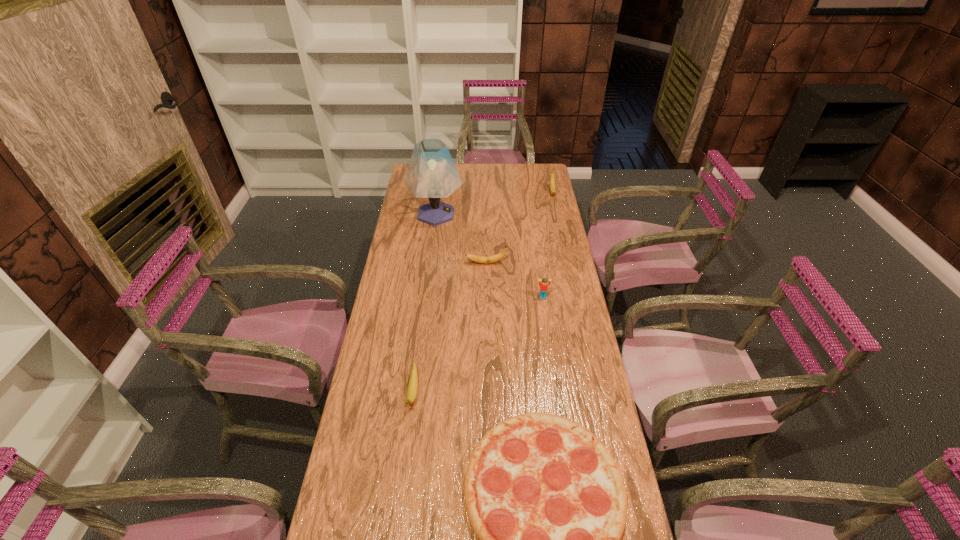
Where is `vacant region located 0.300m at the start of the peel on the farthest banana`? vacant region located 0.300m at the start of the peel on the farthest banana is located at coordinates (563, 236).

The height and width of the screenshot is (540, 960). What are the coordinates of `free spot located 0.060m on the peel of the fourth nearest object from the top` in the screenshot? It's located at (451, 263).

Find the location of a particular element. blank space located on the peel of the fourth nearest object from the top is located at coordinates (393, 263).

Find the location of `vacant space situated on the peel of the fourth nearest object from the top`. vacant space situated on the peel of the fourth nearest object from the top is located at coordinates (390, 263).

Locate an element on the screen. free space located on the face of the Lego is located at coordinates (552, 359).

What are the coordinates of `vacant position located at the stem of the second shortest object` in the screenshot? It's located at (404, 463).

You are a GUI agent. You are given a task and a screenshot of the screen. Output one action in this format:
    pyautogui.click(x=<x>, y=<y>)
    Task: Click on the object at the far edge
    This screenshot has height=540, width=960.
    Given the screenshot: What is the action you would take?
    pyautogui.click(x=552, y=177)

I want to click on lampshade situated at the left edge, so click(432, 174).

Where is `banana at the left edge`? This screenshot has width=960, height=540. banana at the left edge is located at coordinates (413, 382).

Locate an element on the screen. Image resolution: width=960 pixels, height=540 pixels. banana located in the right edge section of the desktop is located at coordinates (552, 177).